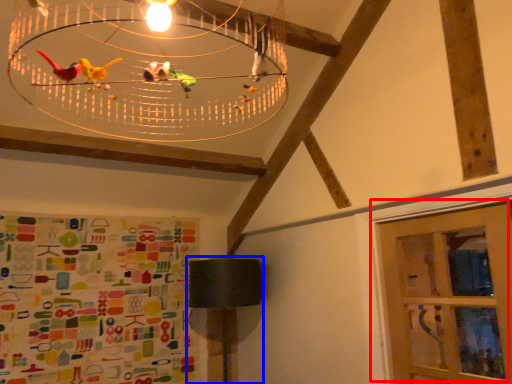
Question: Which point is closer to the camera, door (highlighted by a red box) or table lamp (highlighted by a blue box)?

Choices:
 (A) door
 (B) table lamp

Answer: (A)